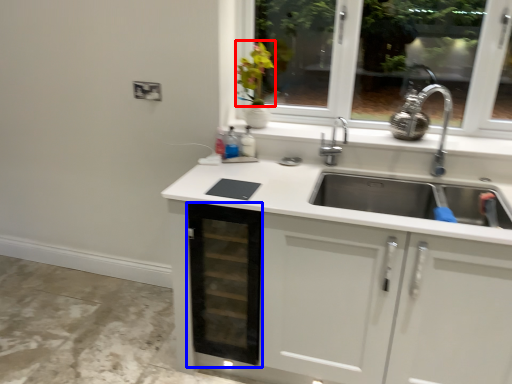
Question: Which object is closer to the camera taking this photo, flower (highlighted by a red box) or drawer (highlighted by a blue box)?

Choices:
 (A) flower
 (B) drawer

Answer: (B)